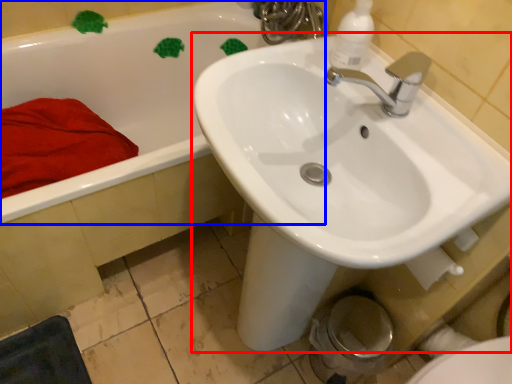
Question: Which of the following is the farthest to the observer, sink (highlighted by a red box) or bathtub (highlighted by a blue box)?

Choices:
 (A) sink
 (B) bathtub

Answer: (B)